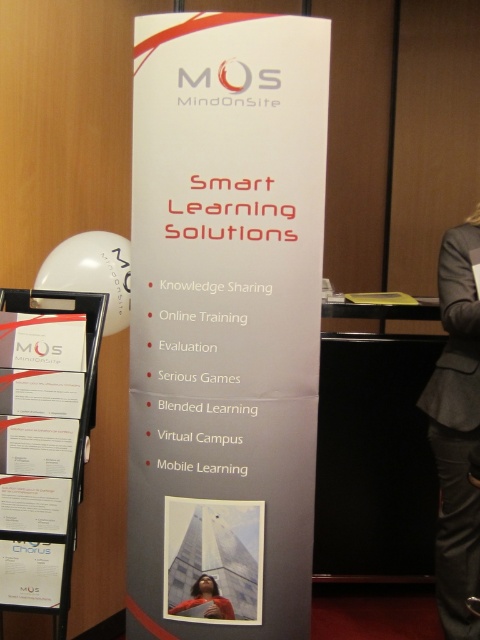
Consider the image. You are a customer service representative at a clothing store. A customer asks if the gray woolen blazer at right can be paired with the matte red poster at center for a promotional display. Based on their sizes, can they be displayed together without one overshadowing the other?

The gray woolen blazer at right is bigger than the matte red poster at center, so if displayed together, the gray woolen blazer at right might overshadow the matte red poster at center due to its larger size.

You are standing 5 feet away from the MOS MindOnSite promotional display. There is a gray woolen blazer at right hanging nearby. If you want to touch the blazer, how many more feet do you need to walk forward?

The gray woolen blazer at right is 7.11 feet away from the viewer. Since you are currently 5 feet away from the display, you need to walk an additional 2.11 feet forward to reach the blazer.

You are a customer at the MOS MindOnSite promotional display. You notice a gray woolen blazer at right and a matte red poster at center. Which item is located to the right of the other?

The gray woolen blazer at right is positioned on the right side of matte red poster at center, so the gray woolen blazer at right is to the right of the matte red poster at center.